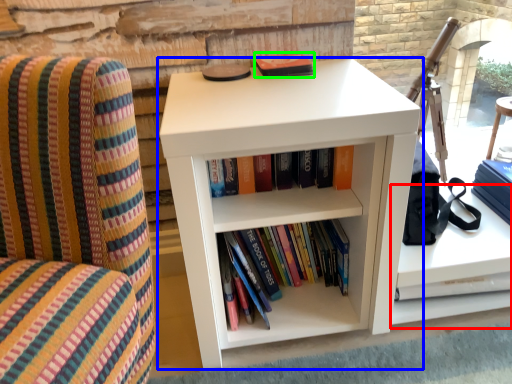
Question: Based on their relative distances, which object is farther from cabinet (highlighted by a red box)? Choose from shelf (highlighted by a blue box) and paperback book (highlighted by a green box).

Choices:
 (A) shelf
 (B) paperback book

Answer: (B)